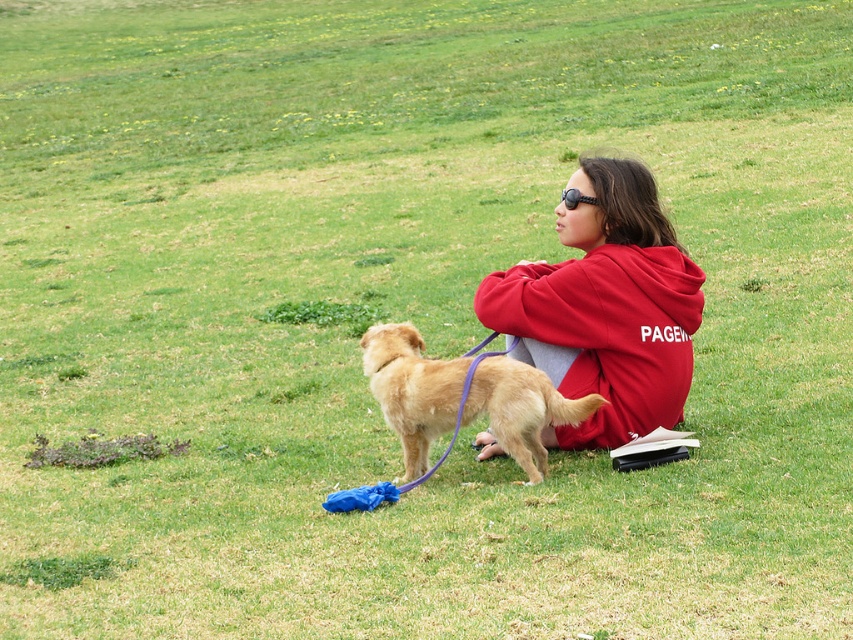
You are a photographer trying to capture a closeup of the golden fur dog at center. You want to ensure the red fleece sweatshirt at center doesn t block the view. Based on their sizes, can you position yourself so the dog is fully visible without the sweatshirt covering it?

The red fleece sweatshirt at center is thinner than the golden fur dog at center, so the dog is wider. Position yourself so the dog is to the side of the sweatshirt, ensuring the thinner sweatshirt doesn t block the wider dog.

You are a photographer standing at the camera position. You want to capture a closeup shot of the red fleece sweatshirt at center. Based on the scene description, do you think you can get a clear closeup without moving closer than 6.98 meters?

The red fleece sweatshirt at center is 6.98 meters away from the camera. To get a clear closeup, you would need to move closer than that distance, so you cannot capture it without moving closer than 6.98 meters.